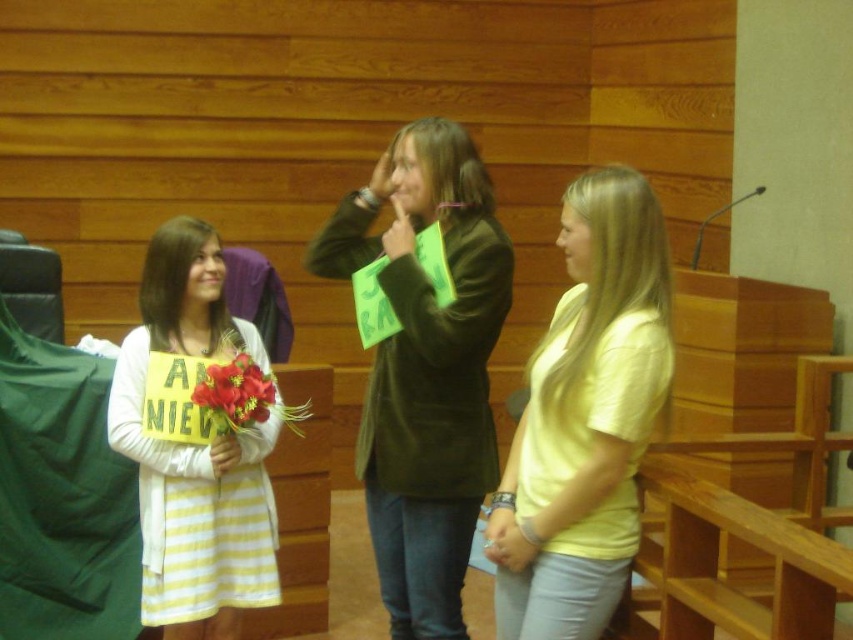
You are organizing a conference and need to ensure that the matte green sign at center and the yellow striped dress at left are visible to all attendees. Based on their sizes, which object should be placed closer to the back to maintain visibility for everyone?

The matte green sign at center is bigger than the yellow striped dress at left, so to maintain visibility for all attendees, the yellow striped dress at left should be placed closer to the back. This way, the larger sign remains prominent while the smaller dress can still be seen without being obscured.

You are a photographer setting up a camera in the room. You need to ensure that both the yellow matte shirt at center and the red silk flower at center are fully visible in the frame. Based on their positions and sizes, which object should you prioritize framing first to avoid cropping?

The yellow matte shirt at center might be wider than red silk flower at center, so you should prioritize framing the yellow matte shirt at center first to ensure it fits within the camera frame before adjusting for the narrower red silk flower at center.

You are standing in the wooden room and want to hand a note to the person wearing the yellow striped dress at left. To reach them, you must pass by the red silk flower at center. Which object should you approach first?

You should approach the yellow striped dress at left first because it is closer to you than the red silk flower at center, so you can reach them before passing the flower.